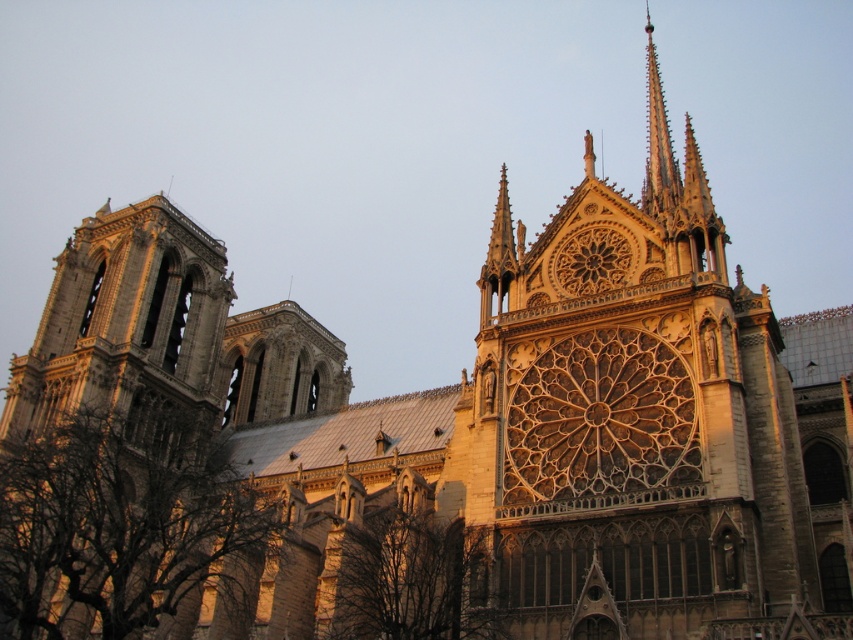
You are standing in front of the Notre Dame Cathedral. You see the stone tower at left and the brown leafless tree at lower center. Which object is closer to the front of the image?

The brown leafless tree at lower center is closer to the front of the image because the stone tower at left is positioned over it, indicating it is further back.

You are standing in front of the Notre Dame Cathedral. You see a stone tower at left and a brown leafless tree at lower center. Which object is positioned to the left of the other?

The stone tower at left is positioned to the left of the brown leafless tree at lower center.